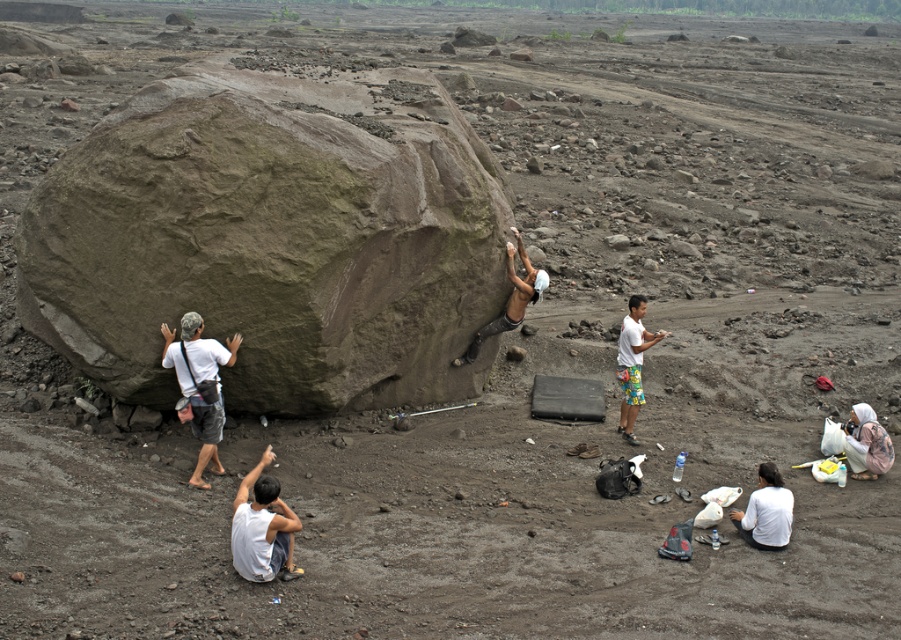
Question: Which point appears closest to the camera in this image?

Choices:
 (A) (170, 353)
 (B) (498, 289)
 (C) (264, 531)

Answer: (C)

Question: Is white cotton shirt at lower center smaller than white cotton shirt at right?

Choices:
 (A) no
 (B) yes

Answer: (B)

Question: Which is farther from the matte gray shorts at left?

Choices:
 (A) green rough rock at left
 (B) white cotton shirt at lower center

Answer: (A)

Question: Does green rough rock at left appear on the left side of white cotton shirt at lower center?

Choices:
 (A) no
 (B) yes

Answer: (A)

Question: Is green rough rock at left further to camera compared to white cotton shirt at lower center?

Choices:
 (A) no
 (B) yes

Answer: (B)

Question: Which point is closer to the camera taking this photo?

Choices:
 (A) (199, 356)
 (B) (394, 316)
 (C) (654, 333)

Answer: (A)